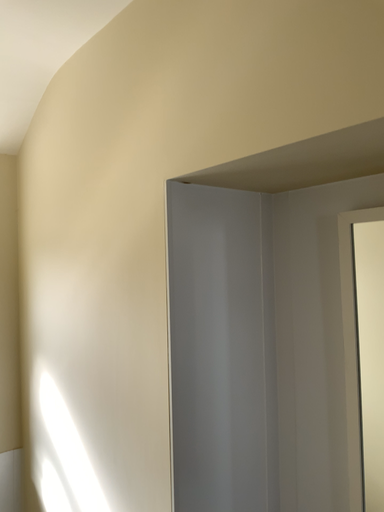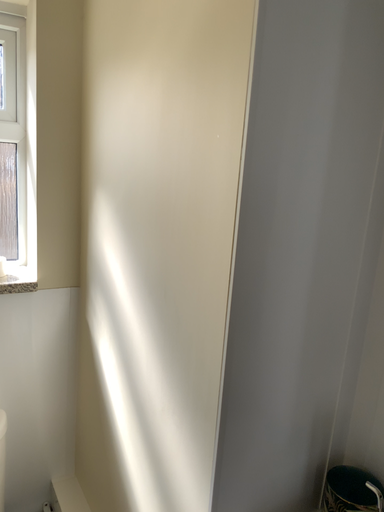
Question: How did the camera likely rotate when shooting the video?

Choices:
 (A) rotated left
 (B) rotated right

Answer: (A)